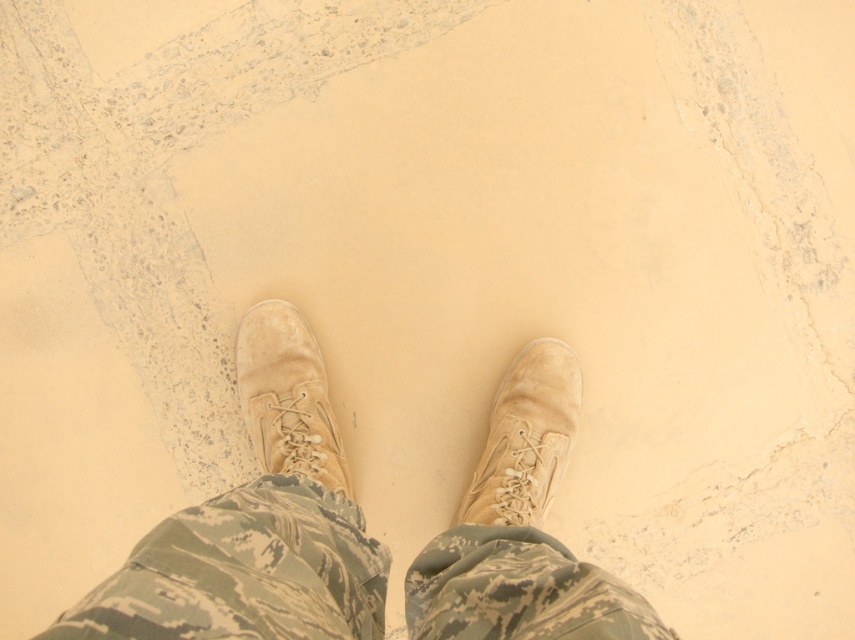
Between tan suede boots at center and suede boot at center, which one appears on the right side from the viewer's perspective?

tan suede boots at center is more to the right.

Where is `tan suede boots at center`? tan suede boots at center is located at coordinates (256, 524).

Is tan suede boots at center above tan suede boot at center?

Actually, tan suede boots at center is below tan suede boot at center.

Who is shorter, tan suede boots at center or tan suede boot at center?

tan suede boots at center

Image resolution: width=855 pixels, height=640 pixels. Describe the element at coordinates (256, 524) in the screenshot. I see `tan suede boots at center` at that location.

Find the location of `tan suede boots at center`. tan suede boots at center is located at coordinates pos(256,524).

Can you confirm if tan suede boot at center is thinner than suede boot at center?

No, tan suede boot at center is not thinner than suede boot at center.

Which is more to the right, tan suede boot at center or suede boot at center?

Positioned to the right is tan suede boot at center.

The image size is (855, 640). What do you see at coordinates (526, 436) in the screenshot? I see `tan suede boot at center` at bounding box center [526, 436].

This screenshot has height=640, width=855. What are the coordinates of `tan suede boot at center` in the screenshot? It's located at (526, 436).